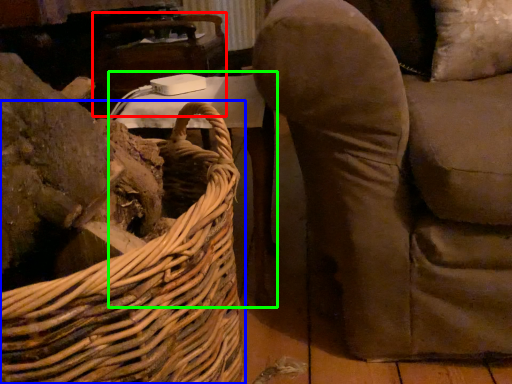
Question: Which object is the farthest from table (highlighted by a red box)? Choose among these: picnic basket (highlighted by a blue box) or table (highlighted by a green box).

Choices:
 (A) picnic basket
 (B) table

Answer: (A)